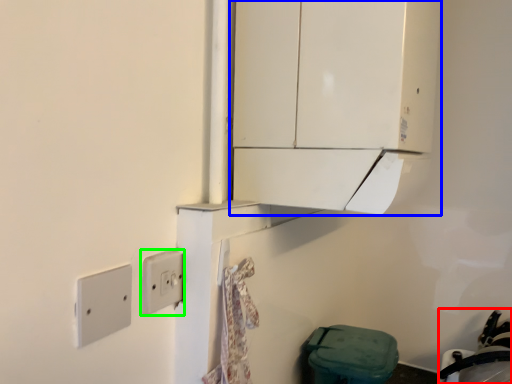
Question: Based on their relative distances, which object is farther from sink (highlighted by a red box)? Choose from cabinetry (highlighted by a blue box) and light switch (highlighted by a green box).

Choices:
 (A) cabinetry
 (B) light switch

Answer: (B)